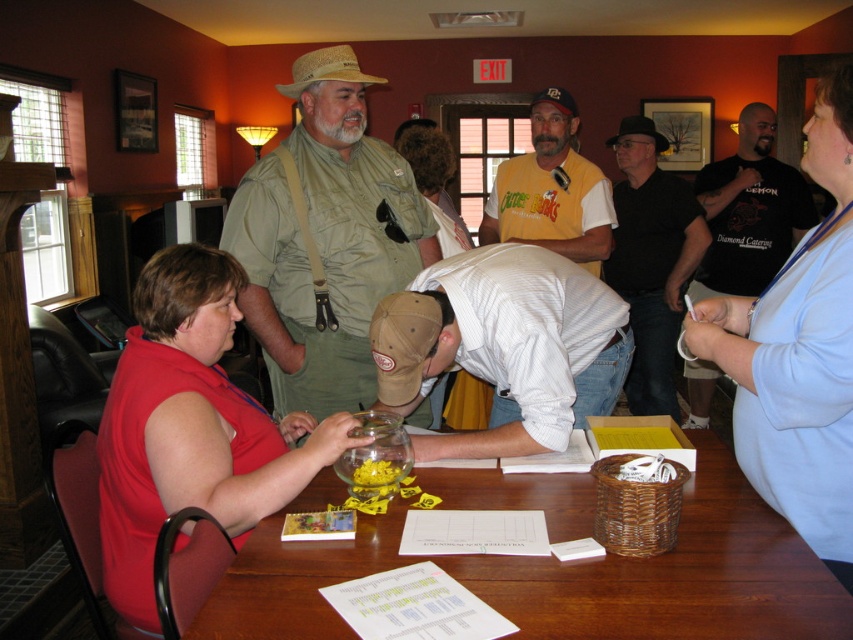
Question: Which object appears farthest from the camera in this image?

Choices:
 (A) black felt cowboy hat at upper center
 (B) yellow jersey at center

Answer: (A)

Question: Which object is positioned closest to the wooden table at lower center?

Choices:
 (A) yellow jersey at center
 (B) black cotton shirt at center
 (C) green canvas shirt at center

Answer: (C)

Question: Is wooden table at lower center smaller than yellow jersey at center?

Choices:
 (A) yes
 (B) no

Answer: (A)

Question: Based on their relative distances, which object is nearer to the wooden table at lower center?

Choices:
 (A) green canvas shirt at center
 (B) yellow jersey at center
 (C) black cotton shirt at upper right

Answer: (A)

Question: From the image, what is the correct spatial relationship of black cotton shirt at upper right in relation to strawhat at center?

Choices:
 (A) below
 (B) above

Answer: (A)

Question: Is green canvas shirt at center thinner than strawhat at center?

Choices:
 (A) no
 (B) yes

Answer: (A)